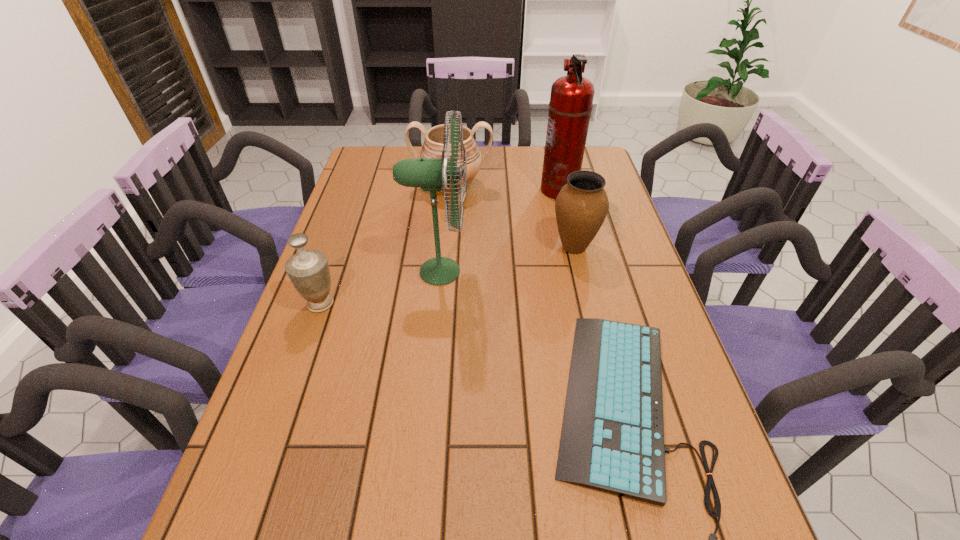
This screenshot has height=540, width=960. Identify the location of object that is the closest to the fire extinguisher. (581, 206).

Locate which urn is the second closest to the farthest urn. Please provide its 2D coordinates. Your answer should be formatted as a tuple, i.e. [(x, y)], where the tuple contains the x and y coordinates of a point satisfying the conditions above.

[(308, 270)]

Locate which urn is the second closest to the fire extinguisher. Please provide its 2D coordinates. Your answer should be formatted as a tuple, i.e. [(x, y)], where the tuple contains the x and y coordinates of a point satisfying the conditions above.

[(432, 147)]

The height and width of the screenshot is (540, 960). I want to click on blank area in the image that satisfies the following two spatial constraints: 1. on the side of the fire extinguisher with the handle and hose; 2. on the left side of the second nearest urn, so click(572, 247).

This screenshot has width=960, height=540. Find the location of `free point that satisfies the following two spatial constraints: 1. on the front-facing side of the second nearest urn; 2. on the right side of the second urn from right to left`. free point that satisfies the following two spatial constraints: 1. on the front-facing side of the second nearest urn; 2. on the right side of the second urn from right to left is located at coordinates (446, 247).

You are a GUI agent. You are given a task and a screenshot of the screen. Output one action in this format:
    pyautogui.click(x=<x>, y=<y>)
    Task: Click on the free space that satisfies the following two spatial constraints: 1. on the front side of the rightmost urn; 2. on the front-facing side of the fan
    This screenshot has height=540, width=960.
    Given the screenshot: What is the action you would take?
    pyautogui.click(x=580, y=272)

The height and width of the screenshot is (540, 960). I want to click on free location that satisfies the following two spatial constraints: 1. on the side of the fire extinguisher with the handle and hose; 2. on the left side of the rightmost urn, so click(572, 247).